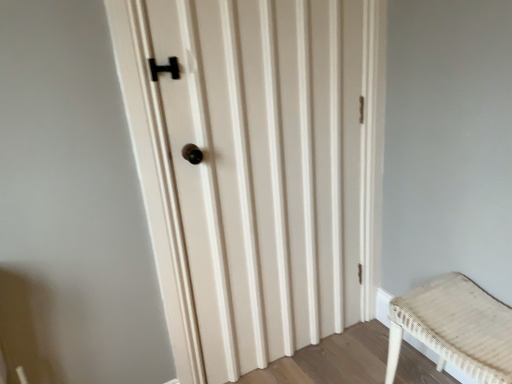
Where is `woven beige bench at lower right`? woven beige bench at lower right is located at coordinates (456, 327).

The width and height of the screenshot is (512, 384). Describe the element at coordinates (456, 327) in the screenshot. I see `woven beige bench at lower right` at that location.

Find the location of `matte wood door at center`. matte wood door at center is located at coordinates (257, 169).

Image resolution: width=512 pixels, height=384 pixels. What do you see at coordinates (257, 169) in the screenshot? I see `matte wood door at center` at bounding box center [257, 169].

The image size is (512, 384). Find the location of `woven beige bench at lower right`. woven beige bench at lower right is located at coordinates (456, 327).

From the picture: Considering the positions of objects woven beige bench at lower right and matte wood door at center in the image provided, who is more to the right, woven beige bench at lower right or matte wood door at center?

From the viewer's perspective, woven beige bench at lower right appears more on the right side.

Which is in front, woven beige bench at lower right or matte wood door at center?

woven beige bench at lower right is more forward.

Does point (477, 355) lie in front of point (265, 107)?

Yes.

From the image's perspective, which is below, woven beige bench at lower right or matte wood door at center?

woven beige bench at lower right.

From a real-world perspective, between woven beige bench at lower right and matte wood door at center, who is vertically higher?

matte wood door at center is physically above.

Can you confirm if woven beige bench at lower right is thinner than matte wood door at center?

In fact, woven beige bench at lower right might be wider than matte wood door at center.

Who is taller, woven beige bench at lower right or matte wood door at center?

matte wood door at center.

Does woven beige bench at lower right have a smaller size compared to matte wood door at center?

Indeed, woven beige bench at lower right has a smaller size compared to matte wood door at center.

Is woven beige bench at lower right situated inside matte wood door at center or outside?

woven beige bench at lower right is spatially situated outside matte wood door at center.

Are woven beige bench at lower right and matte wood door at center making contact?

No, woven beige bench at lower right is not making contact with matte wood door at center.

Is woven beige bench at lower right facing towards matte wood door at center?

No, woven beige bench at lower right is not facing towards matte wood door at center.

How many degrees apart are the facing directions of woven beige bench at lower right and matte wood door at center?

The angle between the facing direction of woven beige bench at lower right and the facing direction of matte wood door at center is 90.1 degrees.

Image resolution: width=512 pixels, height=384 pixels. In the image, there is a matte wood door at center. In order to click on furniture below it (from the image's perspective) in this screenshot , I will do `click(456, 327)`.

Is matte wood door at center at the right side of woven beige bench at lower right?

Incorrect, matte wood door at center is not on the right side of woven beige bench at lower right.

Who is more distant, matte wood door at center or woven beige bench at lower right?

Positioned behind is matte wood door at center.

Does point (353, 221) lie behind point (461, 352)?

Yes, it is.

From the image's perspective, which one is positioned lower, matte wood door at center or woven beige bench at lower right?

woven beige bench at lower right.

From a real-world perspective, which object rests below the other?

woven beige bench at lower right is physically lower.

Considering the sizes of objects matte wood door at center and woven beige bench at lower right in the image provided, who is wider, matte wood door at center or woven beige bench at lower right?

Wider between the two is woven beige bench at lower right.

Does matte wood door at center have a greater height compared to woven beige bench at lower right?

Yes, matte wood door at center is taller than woven beige bench at lower right.

Is matte wood door at center bigger than woven beige bench at lower right?

Indeed, matte wood door at center has a larger size compared to woven beige bench at lower right.

Is matte wood door at center inside or outside of woven beige bench at lower right?

matte wood door at center is not enclosed by woven beige bench at lower right.

Are matte wood door at center and woven beige bench at lower right far apart?

No, matte wood door at center is not far away from woven beige bench at lower right.

Is matte wood door at center turned away from woven beige bench at lower right?

No, matte wood door at center is not facing away from woven beige bench at lower right.

What's the angular difference between matte wood door at center and woven beige bench at lower right's facing directions?

The angle between the facing direction of matte wood door at center and the facing direction of woven beige bench at lower right is 90.1 degrees.

Find the location of a particular element. Image resolution: width=512 pixels, height=384 pixels. door above the woven beige bench at lower right (from a real-world perspective) is located at coordinates (257, 169).

Image resolution: width=512 pixels, height=384 pixels. What are the coordinates of `door above the woven beige bench at lower right (from a real-world perspective)` in the screenshot? It's located at (257, 169).

Where is `furniture in front of the matte wood door at center`? furniture in front of the matte wood door at center is located at coordinates point(456,327).